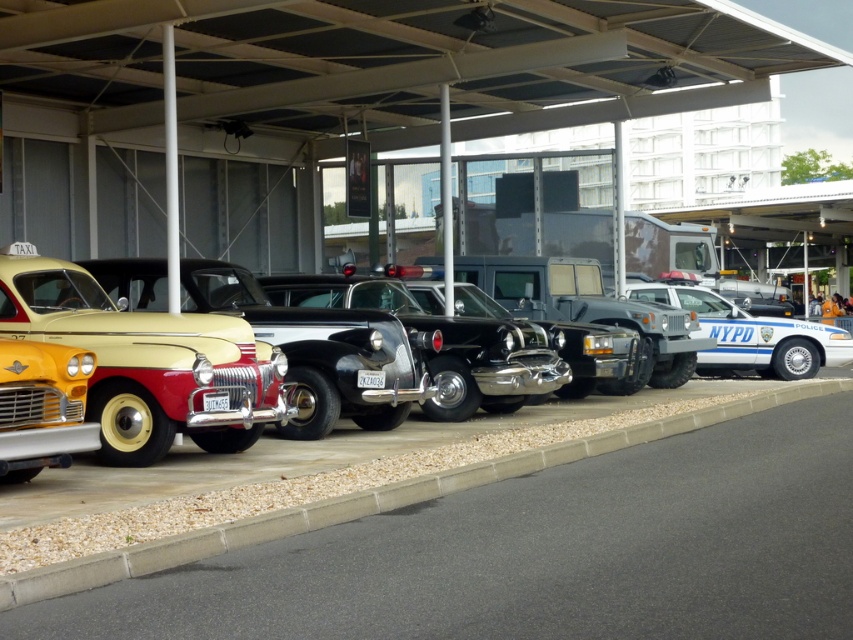
Who is higher up, shiny chrome car at center or yellow matte license plate at center?

Positioned higher is shiny chrome car at center.

This screenshot has width=853, height=640. Find the location of `shiny chrome car at center`. shiny chrome car at center is located at coordinates (190, 365).

Where is `shiny chrome car at center`? The width and height of the screenshot is (853, 640). shiny chrome car at center is located at coordinates (190, 365).

Between matte yellow taxi at left and yellow matte license plate at center, which one appears on the left side from the viewer's perspective?

matte yellow taxi at left

Is matte yellow taxi at left wider than yellow matte license plate at center?

Correct, the width of matte yellow taxi at left exceeds that of yellow matte license plate at center.

I want to click on matte yellow taxi at left, so click(144, 362).

Does matte yellow taxi at left appear on the right side of white glossy police car at right?

Incorrect, matte yellow taxi at left is not on the right side of white glossy police car at right.

The height and width of the screenshot is (640, 853). I want to click on matte yellow taxi at left, so click(x=144, y=362).

Is point (241, 326) farther from viewer compared to point (762, 340)?

No, it is in front of (762, 340).

Image resolution: width=853 pixels, height=640 pixels. In order to click on matte yellow taxi at left in this screenshot , I will do `click(144, 362)`.